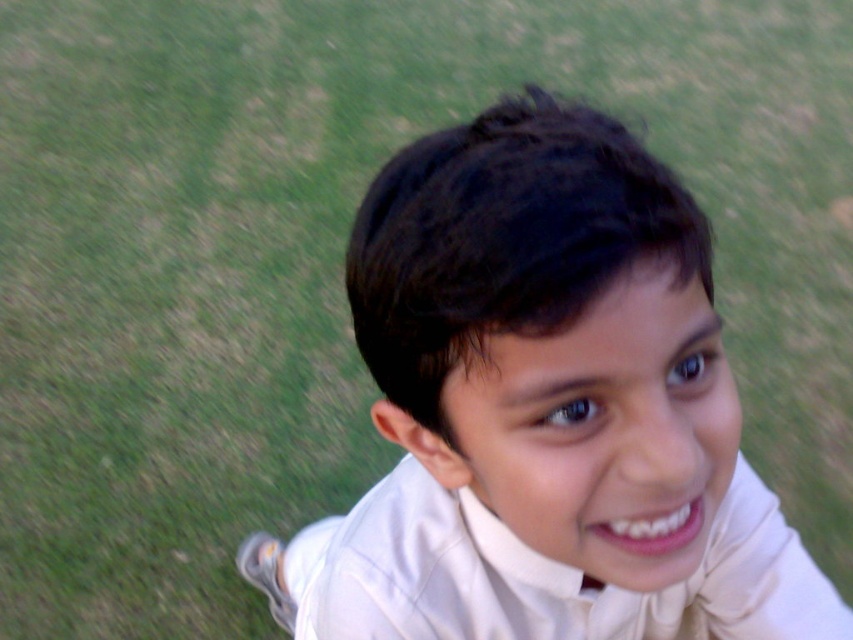
Question: In this image, where is smooth white shirt at center located relative to white satin dress shirt at center?

Choices:
 (A) above
 (B) below

Answer: (A)

Question: Is smooth white shirt at center to the left of white satin dress shirt at center from the viewer's perspective?

Choices:
 (A) no
 (B) yes

Answer: (B)

Question: Which point is closer to the camera?

Choices:
 (A) (386, 493)
 (B) (427, 500)

Answer: (B)

Question: Is smooth white shirt at center smaller than white satin dress shirt at center?

Choices:
 (A) no
 (B) yes

Answer: (A)